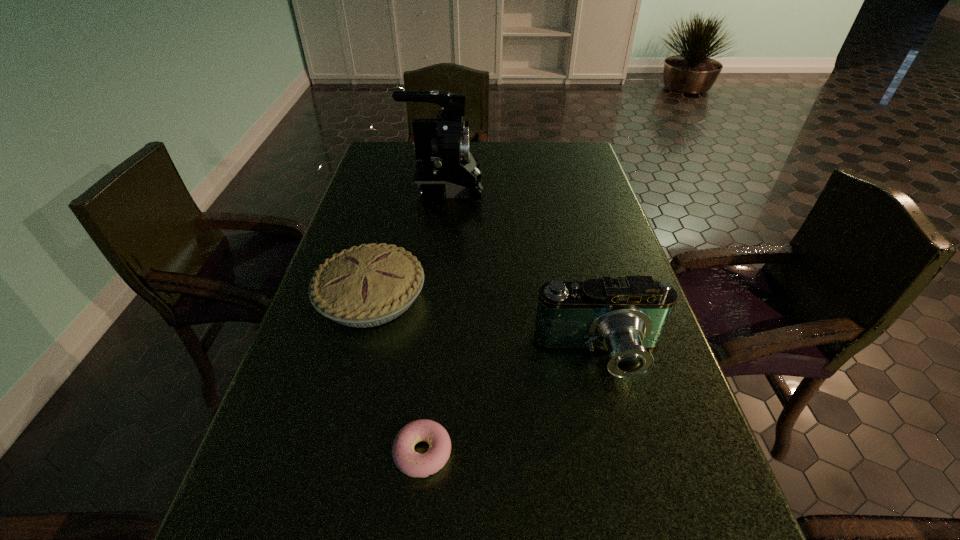
Where is `free region located on the front of the doughnut`? Image resolution: width=960 pixels, height=540 pixels. free region located on the front of the doughnut is located at coordinates (414, 536).

Locate an element on the screen. object present at the far edge is located at coordinates (445, 168).

Locate an element on the screen. This screenshot has height=540, width=960. camcorder at the left edge is located at coordinates (445, 168).

You are a GUI agent. You are given a task and a screenshot of the screen. Output one action in this format:
    pyautogui.click(x=<x>, y=<y>)
    Task: Click on the pie that is positioned at the left edge
    This screenshot has height=540, width=960.
    Given the screenshot: What is the action you would take?
    pyautogui.click(x=372, y=284)

Where is `object that is positioned at the right edge`? Image resolution: width=960 pixels, height=540 pixels. object that is positioned at the right edge is located at coordinates (627, 316).

In order to click on object present at the far left corner in this screenshot , I will do `click(445, 168)`.

Find the location of `free space at the far edge of the desktop`. free space at the far edge of the desktop is located at coordinates pyautogui.click(x=533, y=168).

You are a GUI agent. You are given a task and a screenshot of the screen. Output one action in this format:
    pyautogui.click(x=<x>, y=<y>)
    Task: Click on the vacant space at the left edge of the desktop
    This screenshot has width=960, height=540.
    Given the screenshot: What is the action you would take?
    pyautogui.click(x=369, y=210)

I want to click on free space at the right edge, so [x=611, y=416].

Locate an element on the screen. The height and width of the screenshot is (540, 960). vacant space at the far left corner of the desktop is located at coordinates (412, 172).